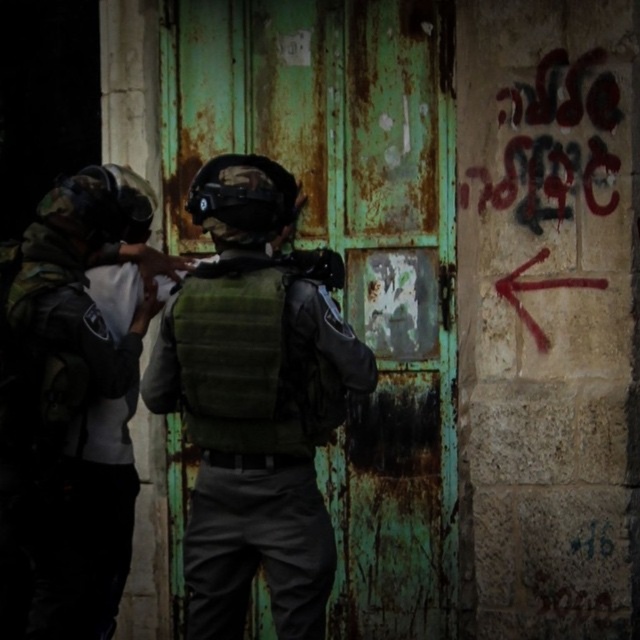
Between rusty metal door at center and camouflage fabric helmet at left, which one is positioned higher?

Positioned higher is rusty metal door at center.

The image size is (640, 640). I want to click on rusty metal door at center, so click(352, 253).